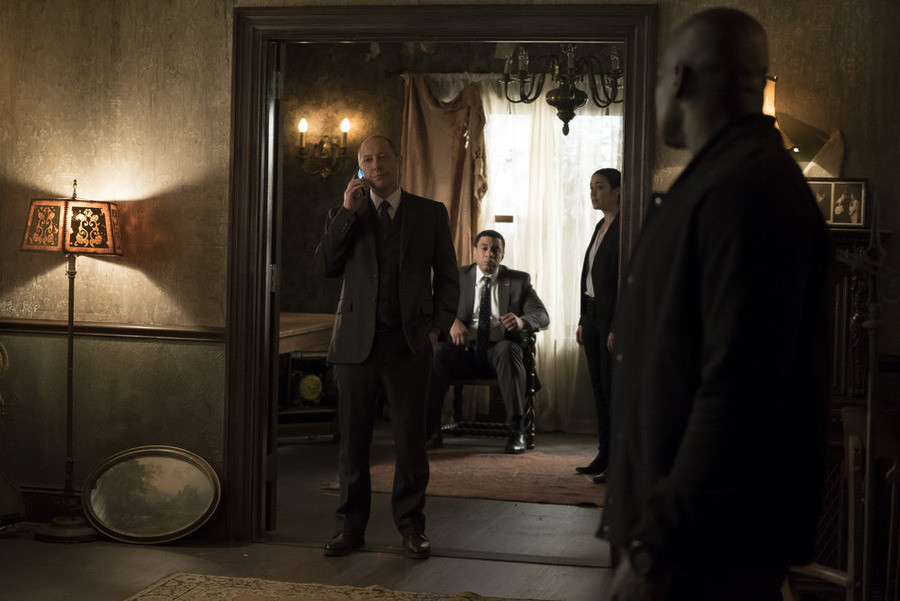
What are the coordinates of `lights` in the screenshot? It's located at point(333,153).